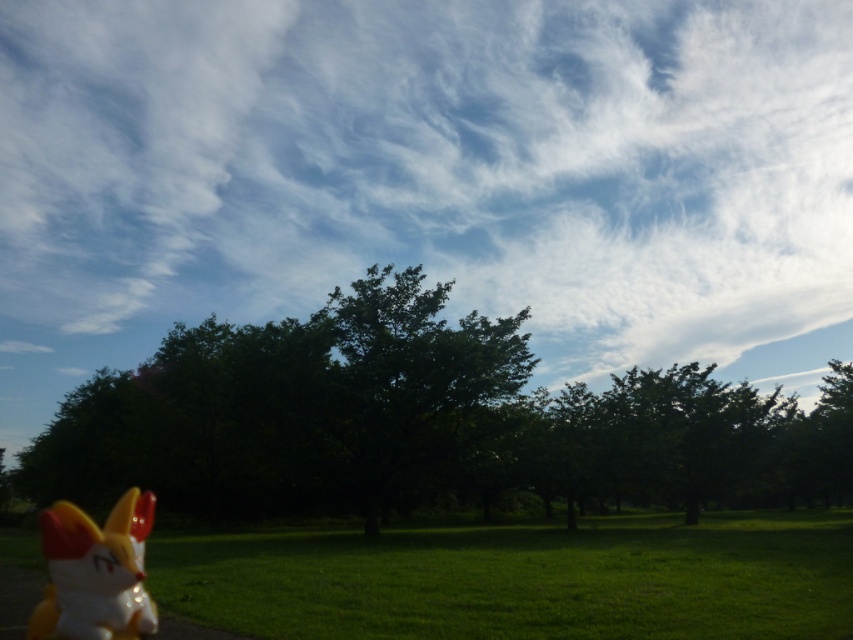
What are the coordinates of the white fluffy cloud at upper center?

The white fluffy cloud at upper center is located at coordinates point [427,177].

You are a photographer standing at the edge of the field. You want to take a photo of the shiny plastic fox at lower left without the green leafy tree at center blocking the view. Is this possible?

The green leafy tree at center is positioned on the right side of the shiny plastic fox at lower left. Since the tree is to the right of the fox, you can move to the left side of the fox to take the photo without the tree blocking the view.